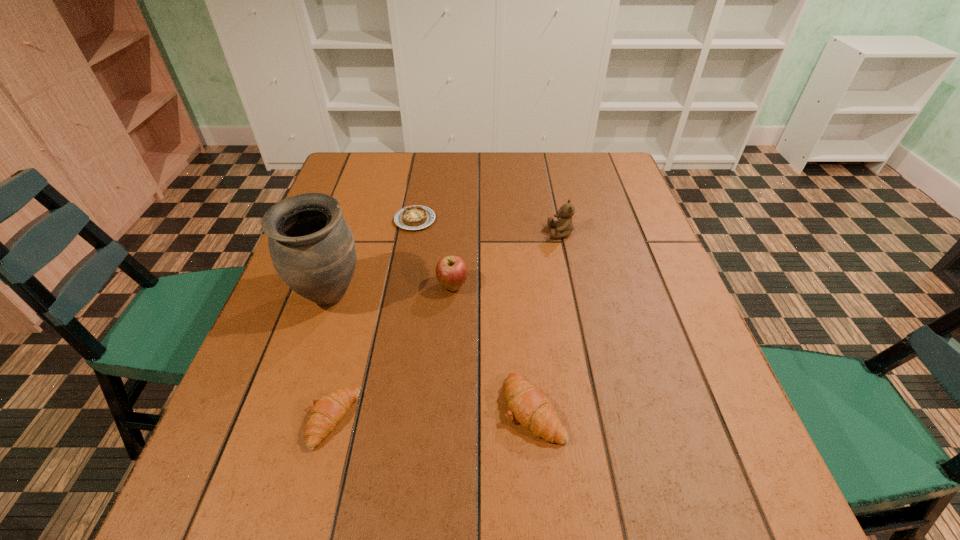
Find the location of `free space between the shortest object and the tallest object`. free space between the shortest object and the tallest object is located at coordinates (372, 258).

Where is `free space between the shortest object and the tallest object`? This screenshot has width=960, height=540. free space between the shortest object and the tallest object is located at coordinates (372, 258).

At what (x,y) coordinates should I click in order to perform the action: click on free area in between the fifth object from left to right and the apple. Please return your answer as a coordinate pair (x, y). The image size is (960, 540). Looking at the image, I should click on (493, 347).

Where is `vacant region between the fifth tallest object and the apple`? The image size is (960, 540). vacant region between the fifth tallest object and the apple is located at coordinates (393, 353).

Where is `free space that is in between the shortest object and the urn`? free space that is in between the shortest object and the urn is located at coordinates (372, 258).

Locate an element on the screen. blank region between the fifth object from left to right and the apple is located at coordinates (493, 347).

This screenshot has height=540, width=960. What are the coordinates of `object that is the nearest to the tallest object` in the screenshot? It's located at (415, 217).

Choose which object is the fifth nearest neighbor to the second shortest object. Please provide its 2D coordinates. Your answer should be formatted as a tuple, i.e. [(x, y)], where the tuple contains the x and y coordinates of a point satisfying the conditions above.

[(564, 225)]

The height and width of the screenshot is (540, 960). I want to click on free space that satisfies the following two spatial constraints: 1. on the front-facing side of the teddy bear; 2. on the front side of the urn, so click(574, 296).

This screenshot has width=960, height=540. In order to click on free space that satisfies the following two spatial constraints: 1. on the front side of the fourth tallest object; 2. on the right side of the quiche in this screenshot , I will do `click(382, 409)`.